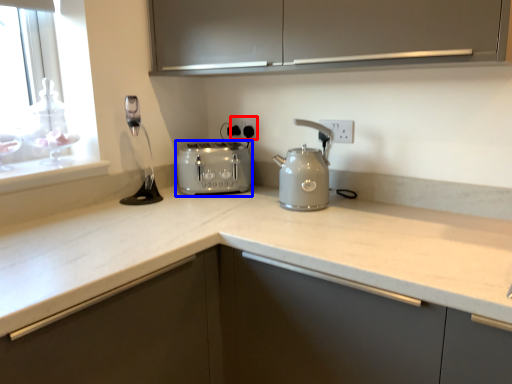
Question: Which object appears closest to the camera in this image, electric outlet (highlighted by a red box) or toaster (highlighted by a blue box)?

Choices:
 (A) electric outlet
 (B) toaster

Answer: (B)